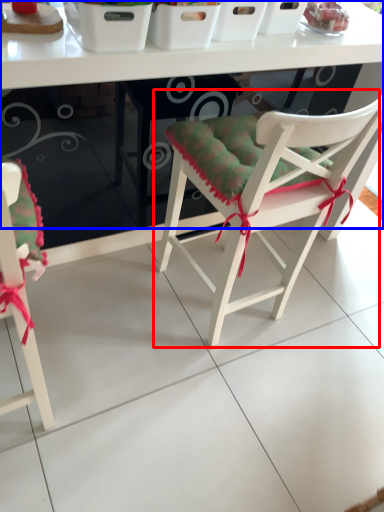
Question: Which point is further to the camera, chair (highlighted by a red box) or table (highlighted by a blue box)?

Choices:
 (A) chair
 (B) table

Answer: (B)